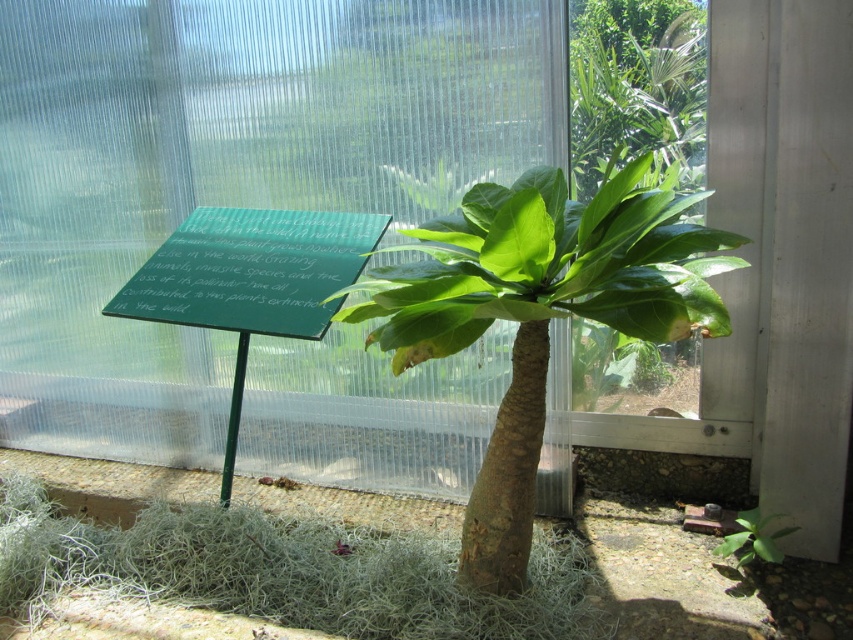
You are standing in front of the plant and want to reach two points marked in the image. Which point, point (498,337) or point (207,275), is closer to you?

Point (498,337) is closer to you because it is further to the viewer than point (207,275).